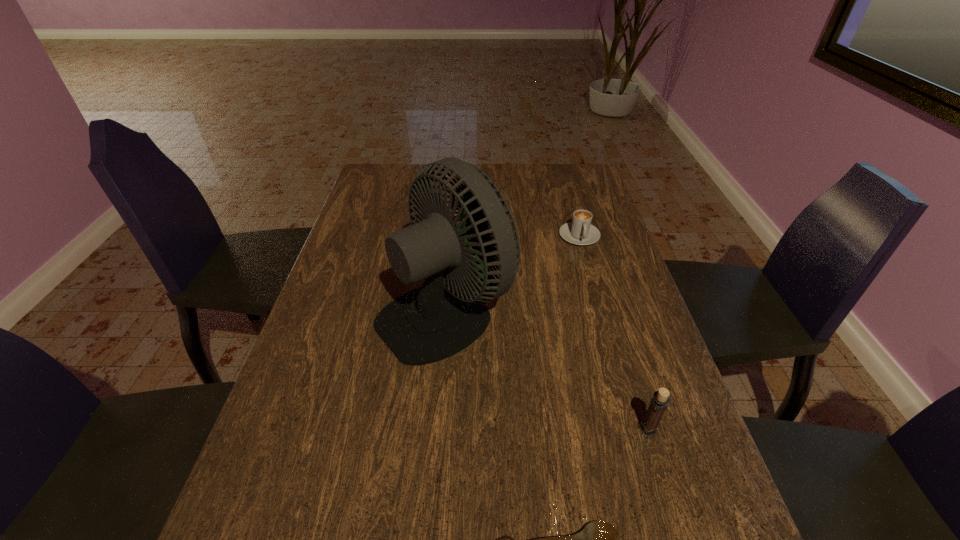
Find the location of `fan`. fan is located at coordinates (433, 322).

Where is `the tallest object`? This screenshot has height=540, width=960. the tallest object is located at coordinates (433, 322).

Identify the location of the third shortest object. Image resolution: width=960 pixels, height=540 pixels. (660, 401).

Find the location of `candle holder`. candle holder is located at coordinates (660, 401).

Identify the location of the farthest object. (580, 231).

The image size is (960, 540). Find the location of `the second shortest object`. the second shortest object is located at coordinates (580, 231).

Where is `vacant space located 0.160m in front of the fan to direct airflow`? The image size is (960, 540). vacant space located 0.160m in front of the fan to direct airflow is located at coordinates (576, 312).

I want to click on free location located 0.070m on the front of the third shortest object, so click(x=660, y=473).

Locate an element on the screen. The height and width of the screenshot is (540, 960). blank area located to the right of the farthest object is located at coordinates [x=588, y=267].

You are a GUI agent. You are given a task and a screenshot of the screen. Output one action in this format:
    pyautogui.click(x=<x>, y=<y>)
    Task: Click on the object that is at the left edge
    This screenshot has height=540, width=960.
    Given the screenshot: What is the action you would take?
    433,322